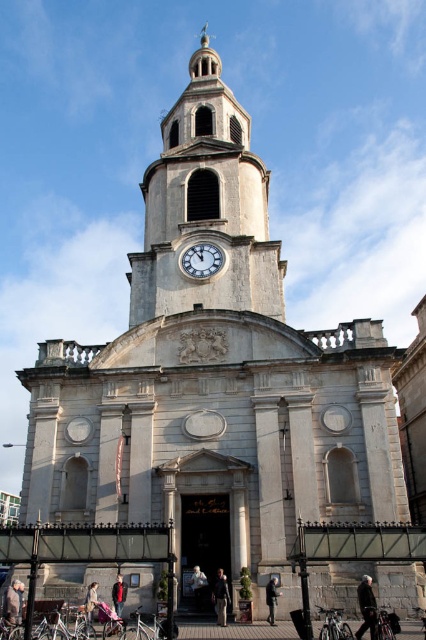
Question: Does light brown leather jacket at lower left appear on the left side of dark gray suit at center?

Choices:
 (A) yes
 (B) no

Answer: (A)

Question: Which point is farther to the camera?

Choices:
 (A) (273, 582)
 (B) (143, 280)

Answer: (B)

Question: Which point is closer to the camera?

Choices:
 (A) (11, 621)
 (B) (365, 588)

Answer: (A)

Question: Which of these objects is positioned farthest from the matte silver clock at upper center?

Choices:
 (A) white stone clock tower at center
 (B) red fabric coat at center

Answer: (B)

Question: Can you confirm if matte silver clock at upper center is thinner than light brown leather jacket at lower left?

Choices:
 (A) no
 (B) yes

Answer: (B)

Question: Is red fabric coat at center further to camera compared to denim jacket at lower left?

Choices:
 (A) yes
 (B) no

Answer: (A)